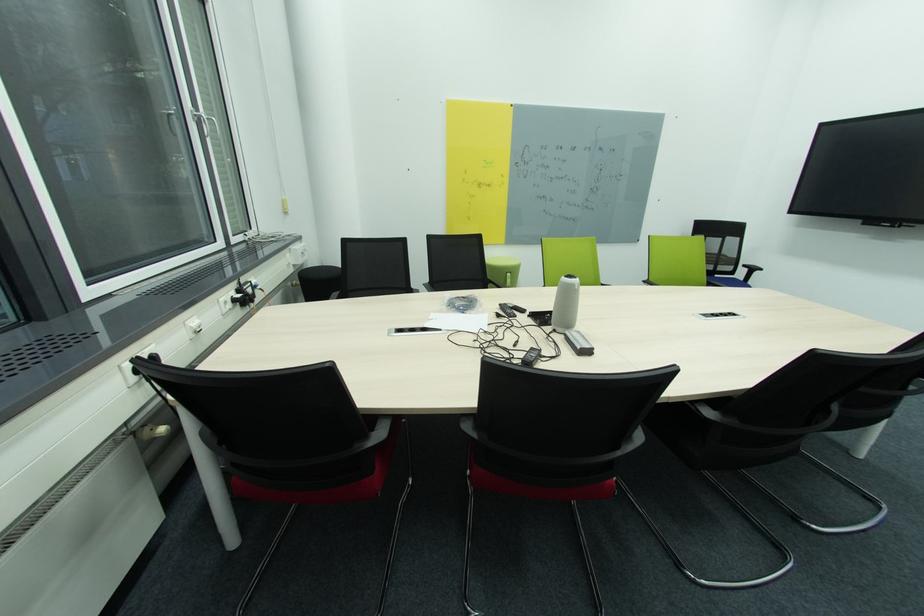
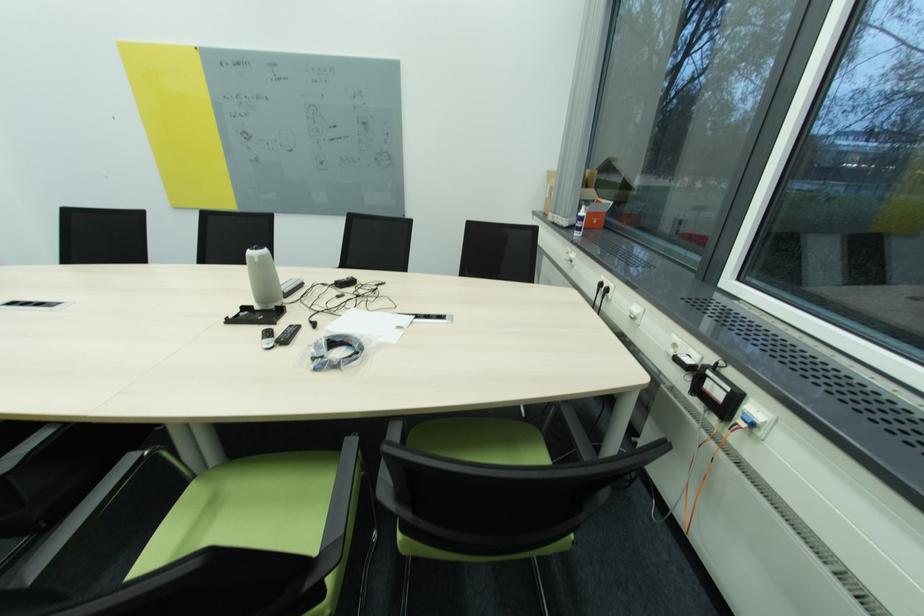
The point at (249, 289) is marked in the first image. Where is the corresponding point in the second image?

(713, 373)